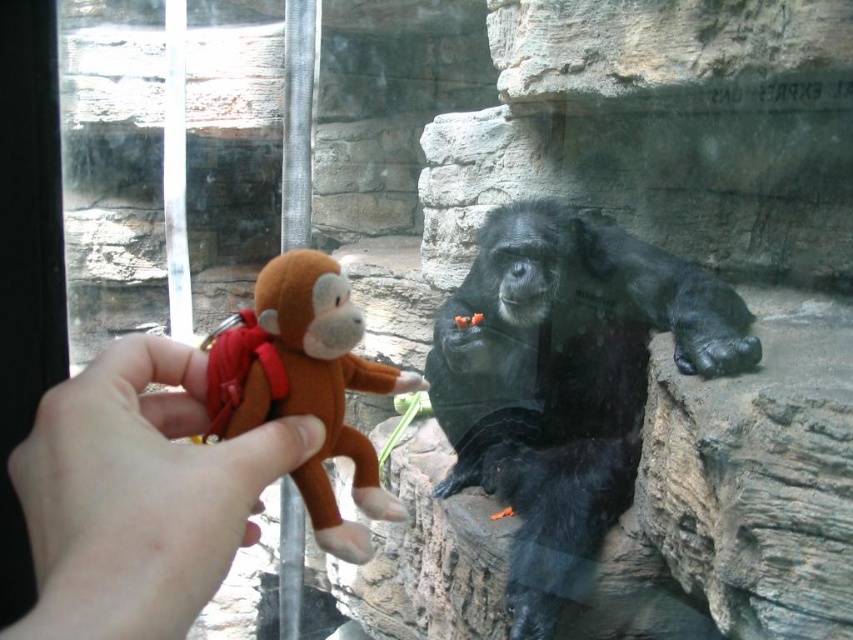
Is brown plush toy at left above brown plush monkey at left?

No.

Does brown plush toy at left have a lesser height compared to brown plush monkey at left?

Yes, brown plush toy at left is shorter than brown plush monkey at left.

I want to click on brown plush toy at left, so click(x=138, y=496).

This screenshot has width=853, height=640. I want to click on brown plush toy at left, so click(x=138, y=496).

Does brown plush monkey at center come behind brown plush toy at left?

That is True.

Can you confirm if brown plush monkey at center is positioned below brown plush toy at left?

Yes, brown plush monkey at center is below brown plush toy at left.

The height and width of the screenshot is (640, 853). Describe the element at coordinates (566, 380) in the screenshot. I see `brown plush monkey at center` at that location.

I want to click on brown plush monkey at center, so click(566, 380).

Who is taller, brown plush monkey at center or brown plush monkey at left?

brown plush monkey at center

Who is lower down, brown plush monkey at center or brown plush monkey at left?

brown plush monkey at center is below.

Image resolution: width=853 pixels, height=640 pixels. Describe the element at coordinates (566, 380) in the screenshot. I see `brown plush monkey at center` at that location.

Find the location of a particular element. The width and height of the screenshot is (853, 640). brown plush monkey at center is located at coordinates (566, 380).